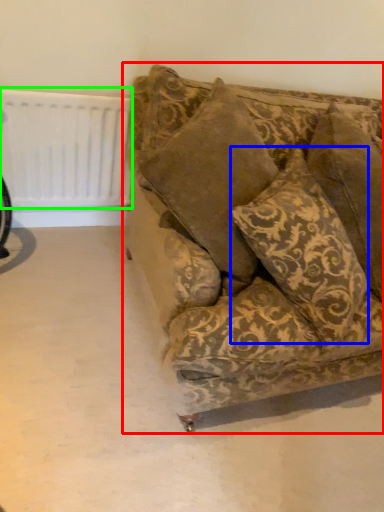
Question: Which is farther away from studio couch (highlighted by a red box)? pillow (highlighted by a blue box) or radiator (highlighted by a green box)?

Choices:
 (A) pillow
 (B) radiator

Answer: (B)